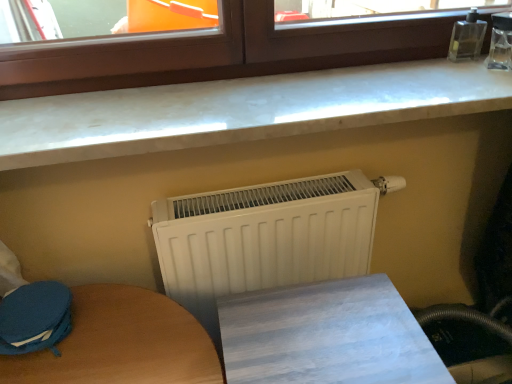
Question: Is wooden table at lower center positioned before blue fabric swivel chair at lower left?

Choices:
 (A) no
 (B) yes

Answer: (B)

Question: Is blue fabric swivel chair at lower left at the back of wooden table at lower center?

Choices:
 (A) no
 (B) yes

Answer: (A)

Question: Does wooden table at lower center have a lesser width compared to blue fabric swivel chair at lower left?

Choices:
 (A) yes
 (B) no

Answer: (B)

Question: From a real-world perspective, is wooden table at lower center located higher than blue fabric swivel chair at lower left?

Choices:
 (A) yes
 (B) no

Answer: (B)

Question: From a real-world perspective, is wooden table at lower center below blue fabric swivel chair at lower left?

Choices:
 (A) no
 (B) yes

Answer: (B)

Question: From a real-world perspective, is blue fabric swivel chair at lower left physically located above or below wooden table at lower center?

Choices:
 (A) above
 (B) below

Answer: (A)

Question: Does point (53, 299) appear closer or farther from the camera than point (308, 292)?

Choices:
 (A) closer
 (B) farther

Answer: (B)

Question: Would you say blue fabric swivel chair at lower left is inside or outside wooden table at lower center?

Choices:
 (A) inside
 (B) outside

Answer: (B)

Question: In the image, is blue fabric swivel chair at lower left on the left side or the right side of wooden table at lower center?

Choices:
 (A) right
 (B) left

Answer: (B)

Question: Based on their positions, is white marble countertop at upper center located to the left or right of blue fabric swivel chair at lower left?

Choices:
 (A) right
 (B) left

Answer: (A)

Question: In terms of height, does white marble countertop at upper center look taller or shorter compared to blue fabric swivel chair at lower left?

Choices:
 (A) short
 (B) tall

Answer: (B)

Question: Does point (400, 79) appear closer or farther from the camera than point (69, 322)?

Choices:
 (A) farther
 (B) closer

Answer: (A)

Question: From a real-world perspective, is white marble countertop at upper center physically located above or below blue fabric swivel chair at lower left?

Choices:
 (A) below
 (B) above

Answer: (B)

Question: From a real-world perspective, relative to brown wood window at upper center, is white matte radiator at center vertically above or below?

Choices:
 (A) above
 (B) below

Answer: (B)

Question: Based on their sizes in the image, would you say white matte radiator at center is bigger or smaller than brown wood window at upper center?

Choices:
 (A) small
 (B) big

Answer: (B)